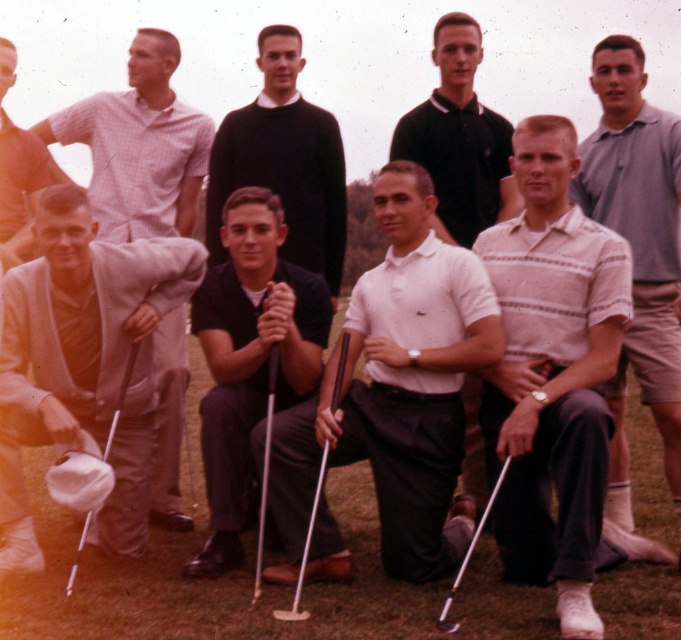
You are a photographer taking a team photo. You notice two polo shirts at the center of the group. Which one is lower in position between the gray cotton polo shirt at center and the white matte polo shirt at center?

The gray cotton polo shirt at center is positioned under the white matte polo shirt at center, so the gray cotton polo shirt at center is lower.

You are a photographer taking a team photo on a golf course. You notice the gray cotton polo shirt at center and the metallic silver golf club at center. Which object is located to the right of the other?

The gray cotton polo shirt at center is positioned on the right side of metallic silver golf club at center, so the gray cotton polo shirt at center is to the right of the metallic silver golf club at center.